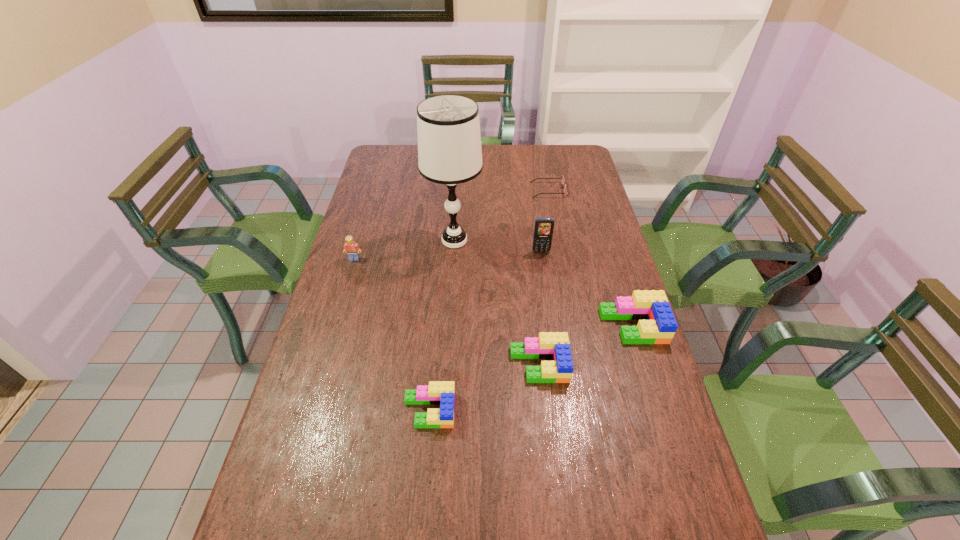
Locate an element on the screen. vacant space that is in between the second shortest Lego and the sunglasses is located at coordinates (543, 278).

This screenshot has width=960, height=540. In order to click on free space between the second tallest object and the sixth tallest object in this screenshot , I will do `click(485, 331)`.

What are the coordinates of `free space between the shortest object and the tallest object` in the screenshot? It's located at (501, 215).

Where is `free space between the shortest object and the third shortest object`? This screenshot has width=960, height=540. free space between the shortest object and the third shortest object is located at coordinates (543, 278).

Identify the location of free space between the farthest Lego and the second Lego from left to right. (392, 334).

You are a GUI agent. You are given a task and a screenshot of the screen. Output one action in this format:
    pyautogui.click(x=<x>, y=<y>)
    Task: Click on the free space between the farthest object and the sixth tallest object
    The width and height of the screenshot is (960, 540).
    Given the screenshot: What is the action you would take?
    pyautogui.click(x=489, y=300)

This screenshot has width=960, height=540. Identify the location of empty space between the second shortest Lego and the leftmost object. (446, 312).

What are the coordinates of `free spot between the rightmost object and the tallest object` in the screenshot? It's located at (543, 283).

Locate an element on the screen. object that stands as the fifth closest to the table lamp is located at coordinates (657, 325).

You are a GUI agent. You are given a task and a screenshot of the screen. Output one action in this format:
    pyautogui.click(x=<x>, y=<y>)
    Task: Click on the second closest object to the fifth farthest object
    Image resolution: width=960 pixels, height=540 pixels.
    Given the screenshot: What is the action you would take?
    pyautogui.click(x=543, y=231)